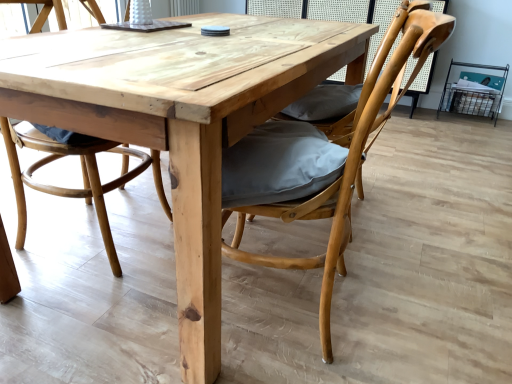
What are the coordinates of `vacant region below natural wood chair at center, which appears as the first chair when viewed from the right (from a real-world perspective)` in the screenshot? It's located at (330, 308).